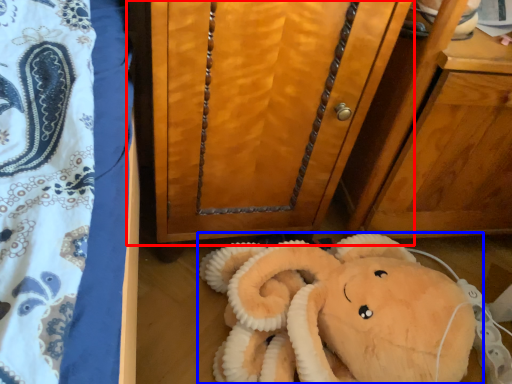
Question: Which point is closer to the camera, furniture (highlighted by a red box) or toy (highlighted by a blue box)?

Choices:
 (A) furniture
 (B) toy

Answer: (A)